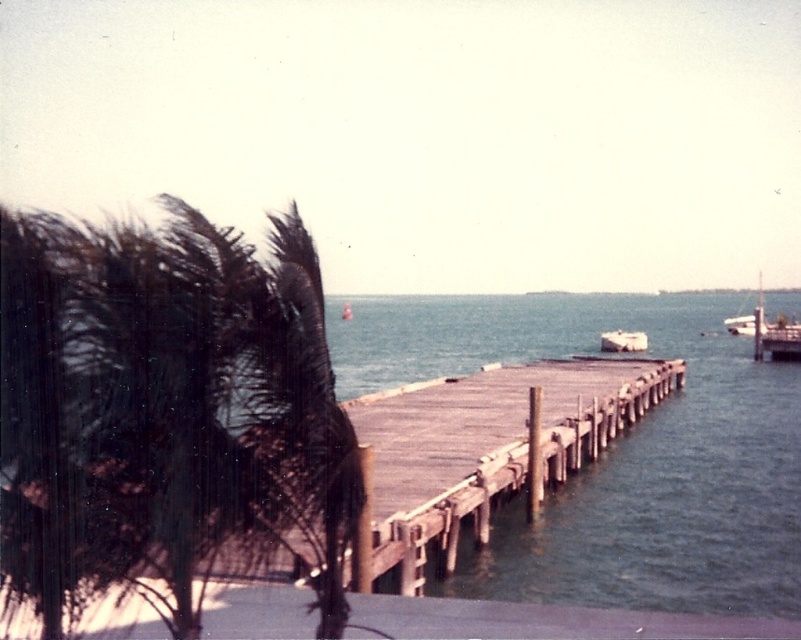
You are standing on the wooden dock at center and want to look at the dark green fronds at left. Which direction should you turn to see them?

The dark green fronds at left are much taller than the wooden dock at center, so you should turn to your left to see them.

You are a photographer planning to capture both the white matte boat at center and the white glossy boat at right in a single frame. Given their sizes in the image, which boat should you position closer to the center of your camera viewfinder to ensure both fit comfortably?

Since the white matte boat at center occupies less space than the white glossy boat at right, you should position the white glossy boat at right closer to the center of your camera viewfinder. This allows more room for the larger boat while still including the smaller one in the frame.

You are a photographer planning to take a photo of the dark green fronds at left and the white glossy boat at right. Based on their positions, which object should you focus on first if you want to capture both in a single frame without moving the camera?

The dark green fronds at left should be focused on first because they are positioned below the white glossy boat at right, so adjusting focus to the lower area will naturally include the boat above.